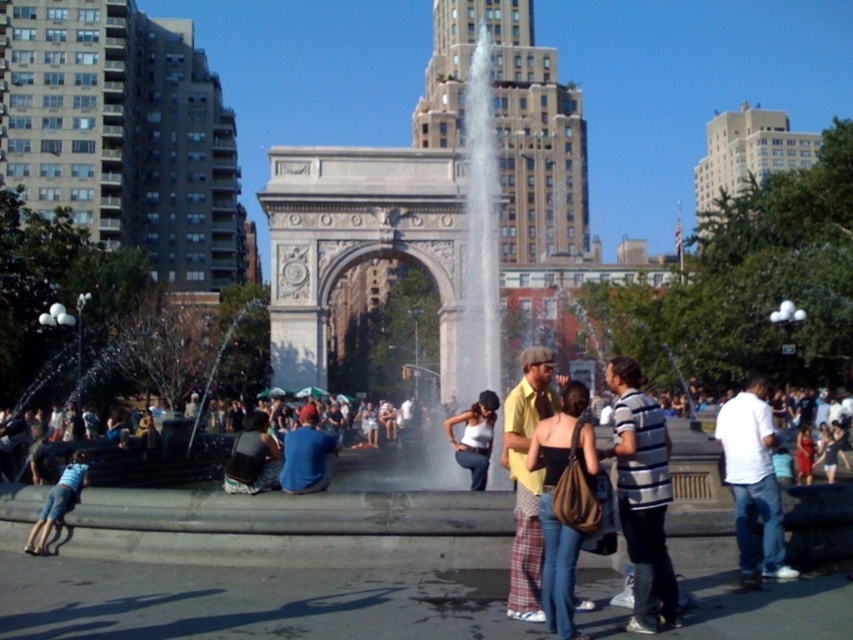
Question: Which object is positioned closest to the light blue denim shorts at lower left?

Choices:
 (A) yellow cotton shirt at center
 (B) white cotton shirt at center-right
 (C) dark brown leather jacket at center
 (D) blue cotton shirt at center

Answer: (C)

Question: Which point is closer to the camera?

Choices:
 (A) yellow cotton shirt at center
 (B) striped cotton shirt at center
 (C) white cotton shirt at center-right

Answer: (B)

Question: Estimate the real-world distances between objects in this image. Which object is farther from the blue cotton shirt at center?

Choices:
 (A) dark brown leather jacket at center
 (B) white cotton tank top at center
 (C) striped cotton shirt at center
 (D) matte brown shoulder bag at center

Answer: (C)

Question: Can you confirm if white cotton shirt at center-right is smaller than blue cotton shirt at center?

Choices:
 (A) no
 (B) yes

Answer: (B)

Question: Is yellow cotton shirt at center wider than light blue denim shorts at lower left?

Choices:
 (A) yes
 (B) no

Answer: (A)

Question: Is white cotton tank top at center to the left of light blue denim shorts at lower left from the viewer's perspective?

Choices:
 (A) yes
 (B) no

Answer: (B)